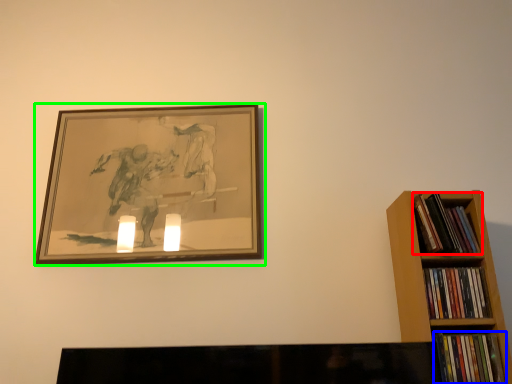
Question: Considering the real-world distances, which object is farthest from book (highlighted by a red box)? book (highlighted by a blue box) or picture frame (highlighted by a green box)?

Choices:
 (A) book
 (B) picture frame

Answer: (B)